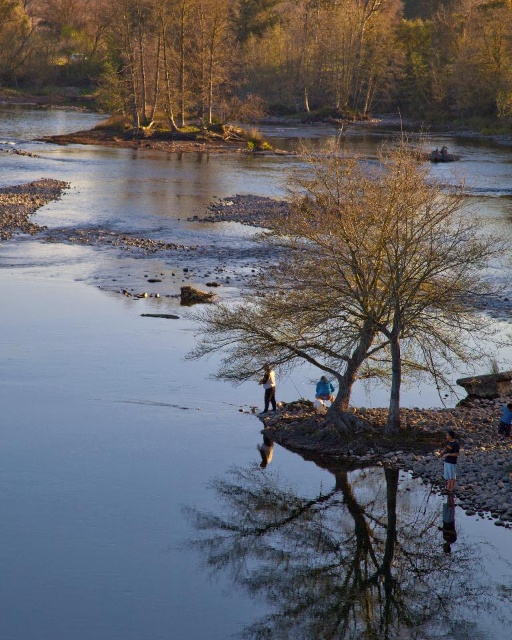
Is brown leafy tree at center shorter than blue denim shorts at lower right?

In fact, brown leafy tree at center may be taller than blue denim shorts at lower right.

Is point (334, 296) positioned after point (453, 449)?

Yes, it is behind point (453, 449).

The image size is (512, 640). In order to click on brown leafy tree at center in this screenshot , I will do `click(364, 280)`.

Which is more to the left, brown leafy tree at center or blue denim jeans at lower center?

From the viewer's perspective, blue denim jeans at lower center appears more on the left side.

Between brown leafy tree at center and blue denim jeans at lower center, which one appears on the right side from the viewer's perspective?

brown leafy tree at center is more to the right.

Who is more distant from viewer, [321,284] or [328,384]?

The point [328,384] is behind.

At what (x,y) coordinates should I click in order to perform the action: click on brown leafy tree at center. Please return your answer as a coordinate pair (x, y). Looking at the image, I should click on (364, 280).

From the picture: Is green leafy tree at upper center to the right of blue denim shorts at lower right from the viewer's perspective?

No, green leafy tree at upper center is not to the right of blue denim shorts at lower right.

Does green leafy tree at upper center have a greater height compared to blue denim shorts at lower right?

Indeed, green leafy tree at upper center has a greater height compared to blue denim shorts at lower right.

Is point (350, 100) farther from viewer compared to point (454, 451)?

Yes.

Find the location of a particular element. The image size is (512, 640). green leafy tree at upper center is located at coordinates (266, 58).